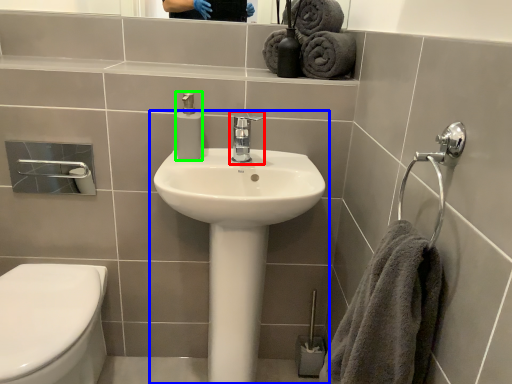
Question: Considering the real-world distances, which object is closest to tap (highlighted by a red box)? sink (highlighted by a blue box) or soap dispenser (highlighted by a green box).

Choices:
 (A) sink
 (B) soap dispenser

Answer: (B)